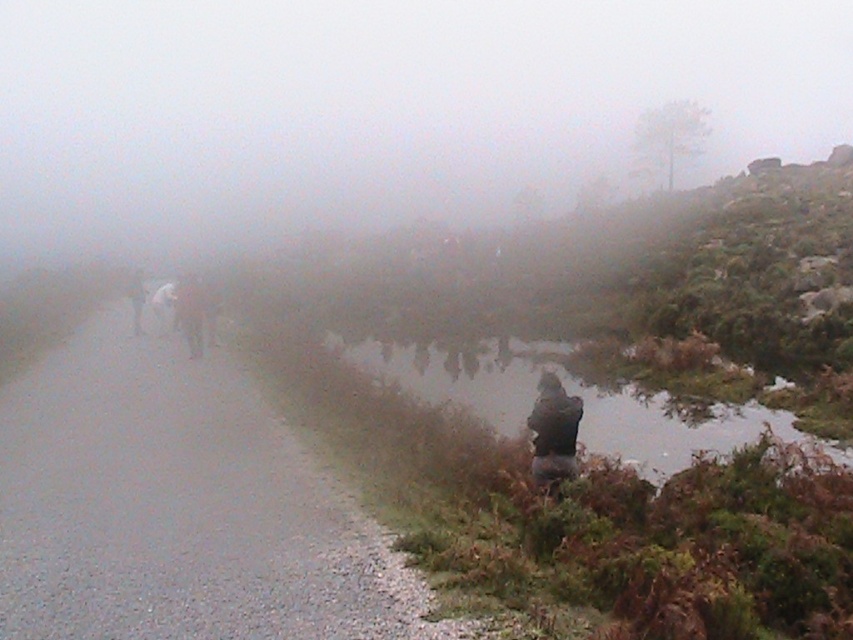
At what (x,y) coordinates should I click in order to perform the action: click on brown leather jacket at left. Please return your answer as a coordinate pair (x, y). Looking at the image, I should click on (183, 308).

Is point (190, 342) positioned after point (142, 308)?

No, it is not.

Between point (187, 320) and point (137, 285), which one is positioned in front?

Point (187, 320)

The height and width of the screenshot is (640, 853). Identify the location of brown leather jacket at left. (183, 308).

Does gray gravel road at left have a greater height compared to brown leather jacket at left?

No.

Is point (183, 586) farther from camera compared to point (136, 305)?

No, it is in front of (136, 305).

Is point (206, 592) farther from camera compared to point (183, 333)?

No, (206, 592) is closer to viewer.

Where is `gray gravel road at left`? The image size is (853, 640). gray gravel road at left is located at coordinates (177, 508).

Does gray gravel road at left appear over white fabric jacket at left?

No, gray gravel road at left is not above white fabric jacket at left.

Which is behind, point (161, 540) or point (136, 317)?

The point (136, 317) is behind.

Where is `gray gravel road at left`? The width and height of the screenshot is (853, 640). gray gravel road at left is located at coordinates click(x=177, y=508).